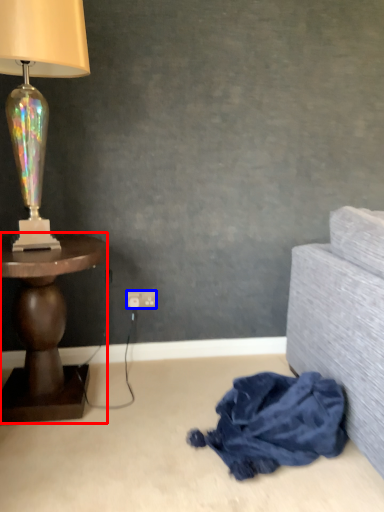
Question: Which point is closer to the camera, table (highlighted by a red box) or power outlet (highlighted by a blue box)?

Choices:
 (A) table
 (B) power outlet

Answer: (A)